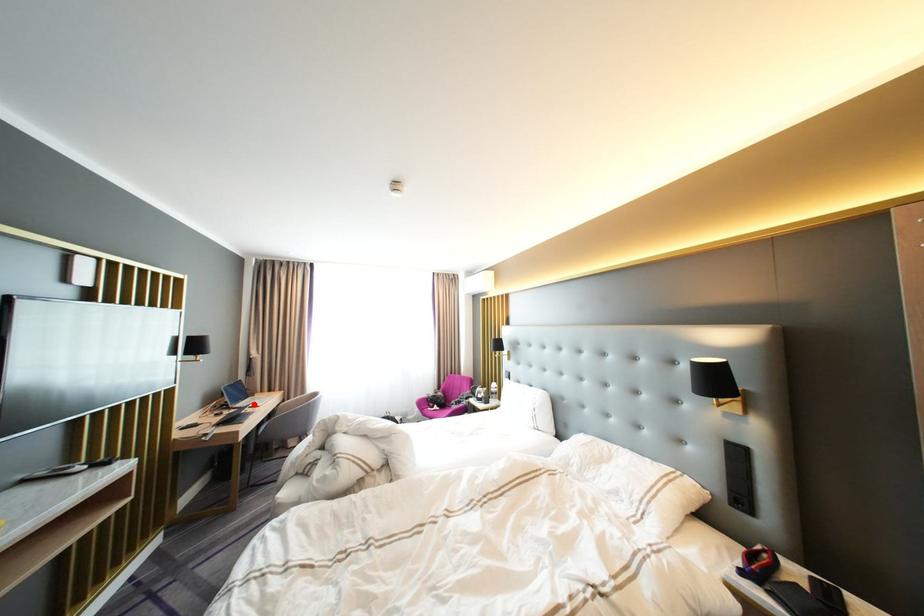
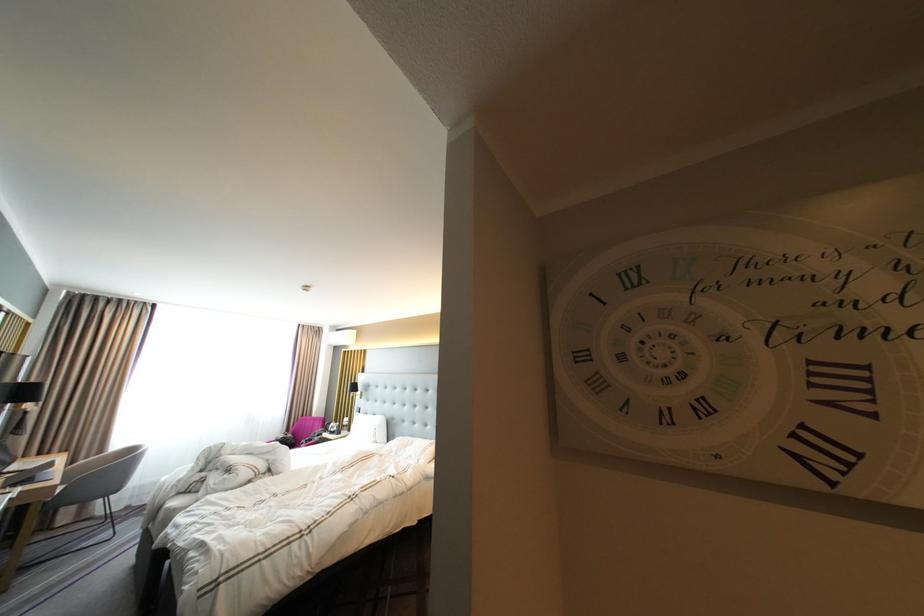
Question: I am providing you with two images of the same scene from different viewpoints. A red point is shown in image1. For the corresponding object point in image2, is it positioned nearer or farther from the camera?

Choices:
 (A) Nearer
 (B) Farther

Answer: (B)